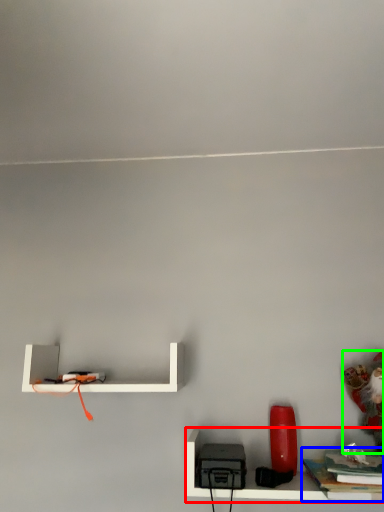
Question: Considering the real-world distances, which object is farthest from shelf (highlighted by a red box)? book (highlighted by a blue box) or toy (highlighted by a green box)?

Choices:
 (A) book
 (B) toy

Answer: (B)